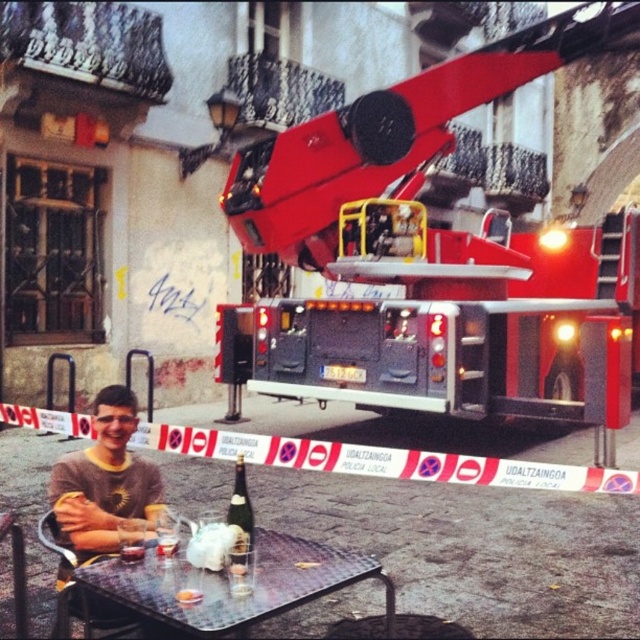
Who is positioned more to the right, gray sweater at lower left or clear glass wine at table center?

Positioned to the right is clear glass wine at table center.

Who is more forward, (113, 532) or (192, 593)?

Point (192, 593) is in front.

I want to click on gray sweater at lower left, so click(x=106, y=483).

Locate an element on the screen. Image resolution: width=640 pixels, height=640 pixels. gray sweater at lower left is located at coordinates (106, 483).

Where is `matte glass bottle at table center`? The height and width of the screenshot is (640, 640). matte glass bottle at table center is located at coordinates (241, 532).

Between point (228, 561) and point (196, 596), which one is positioned in front?

Positioned in front is point (196, 596).

Identify the location of matte glass bottle at table center. (241, 532).

Who is positioned more to the right, shiny red fire truck at upper right or metallic silver table at center?

Positioned to the right is shiny red fire truck at upper right.

Looking at this image, does shiny red fire truck at upper right have a smaller size compared to metallic silver table at center?

Indeed, shiny red fire truck at upper right has a smaller size compared to metallic silver table at center.

What do you see at coordinates (440, 237) in the screenshot? I see `shiny red fire truck at upper right` at bounding box center [440, 237].

Where is `shiny red fire truck at upper right`? shiny red fire truck at upper right is located at coordinates (440, 237).